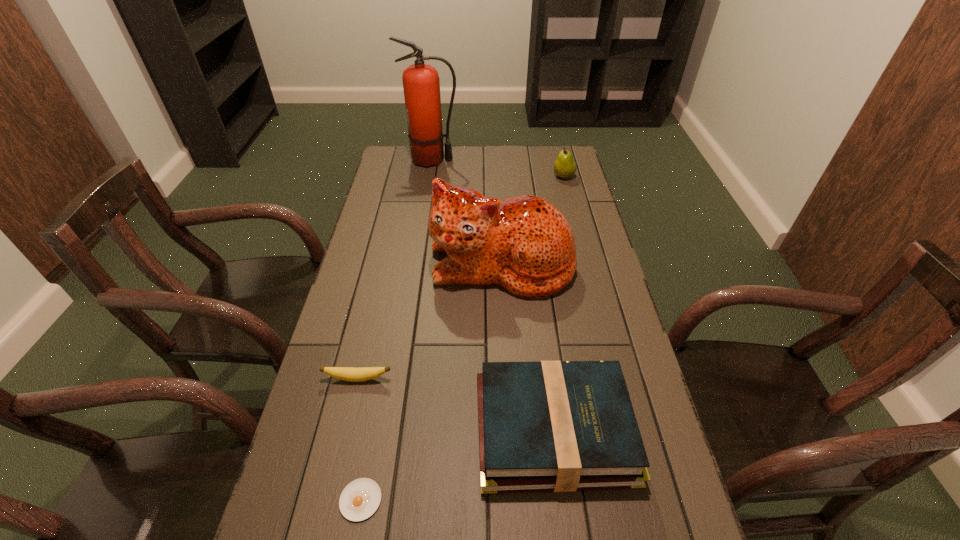
In order to click on free space between the second shortest object and the fourth tallest object in this screenshot , I will do click(456, 404).

You are a GUI agent. You are given a task and a screenshot of the screen. Output one action in this format:
    pyautogui.click(x=<x>, y=<y>)
    Task: Click on the free area in between the second farthest object and the shortest object
    This screenshot has height=540, width=960.
    Given the screenshot: What is the action you would take?
    pyautogui.click(x=462, y=338)

Where is `free space between the shortest object and the third farthest object`? free space between the shortest object and the third farthest object is located at coordinates (431, 382).

In order to click on unoccupied position between the tallest object and the third tallest object in this screenshot , I will do `click(497, 168)`.

Where is `free space that is in between the second shortest object and the shortest object`? The height and width of the screenshot is (540, 960). free space that is in between the second shortest object and the shortest object is located at coordinates (359, 439).

The image size is (960, 540). What are the coordinates of `free space between the second shortest object and the cat` in the screenshot? It's located at (430, 321).

This screenshot has height=540, width=960. Find the location of `free area in between the shortest object and the fire extinguisher`. free area in between the shortest object and the fire extinguisher is located at coordinates (396, 330).

Locate an element on the screen. empty space between the cat and the fourth tallest object is located at coordinates (528, 347).

Find the location of a particular element. object that stands as the second closest to the tallest object is located at coordinates (524, 244).

Image resolution: width=960 pixels, height=540 pixels. Find the location of `the fourth closest object to the fire extinguisher`. the fourth closest object to the fire extinguisher is located at coordinates (563, 426).